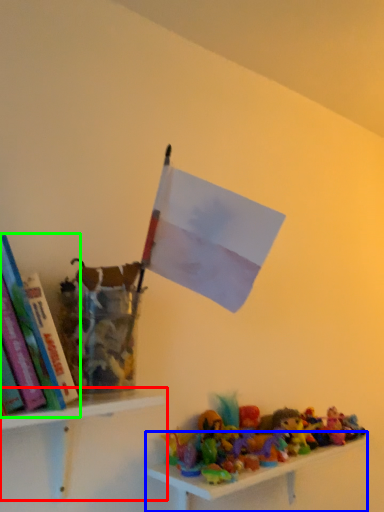
Question: Which is farther away from shelf (highlighted by a red box)? shelf (highlighted by a blue box) or book (highlighted by a green box)?

Choices:
 (A) shelf
 (B) book

Answer: (A)